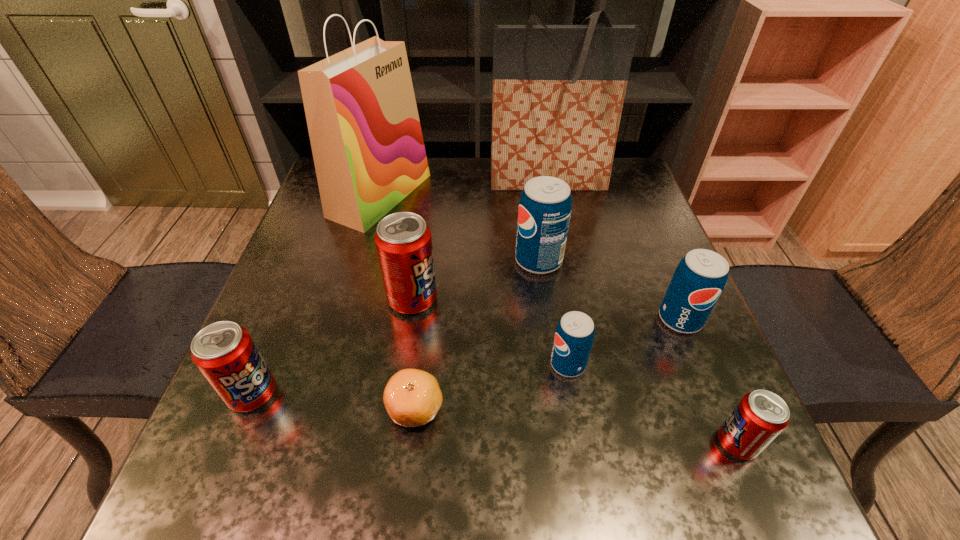
Identify the location of red soda can identified as the closest to the third farthest object. The width and height of the screenshot is (960, 540). (403, 241).

Where is `red soda can that is the nearest to the right shopping bag`? red soda can that is the nearest to the right shopping bag is located at coordinates (403, 241).

Where is `vacant space that satisfies the following two spatial constraints: 1. on the front side of the left shopping bag; 2. on the left side of the smallest red soda can`? Image resolution: width=960 pixels, height=540 pixels. vacant space that satisfies the following two spatial constraints: 1. on the front side of the left shopping bag; 2. on the left side of the smallest red soda can is located at coordinates (312, 443).